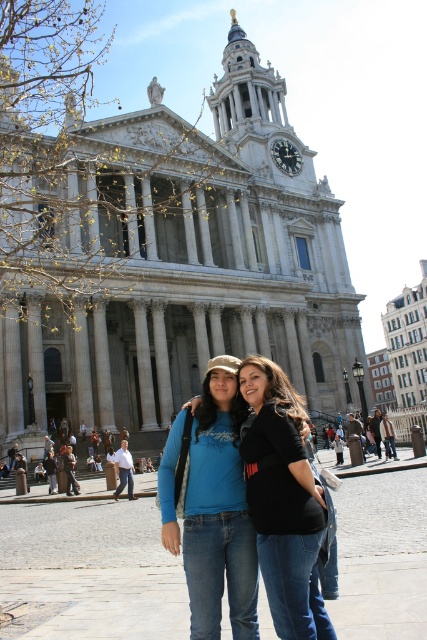
Who is taller, matte blue shirt at center or denim jeans at center?

With more height is matte blue shirt at center.

The height and width of the screenshot is (640, 427). What do you see at coordinates (219, 515) in the screenshot?
I see `matte blue shirt at center` at bounding box center [219, 515].

What do you see at coordinates (219, 515) in the screenshot?
I see `matte blue shirt at center` at bounding box center [219, 515].

The height and width of the screenshot is (640, 427). Identify the location of matte blue shirt at center. (219, 515).